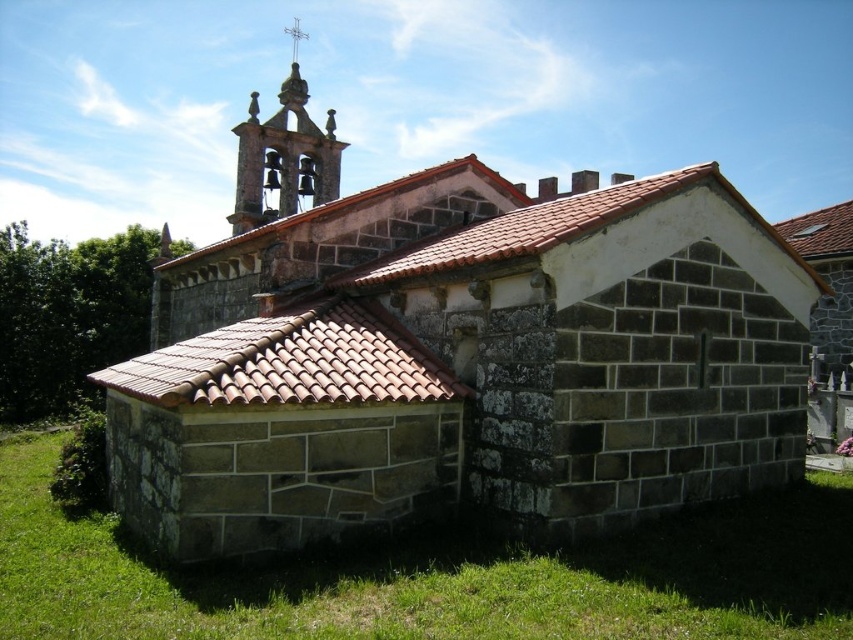
Who is shorter, green grass at lower center or brown tile roof at upper center?

green grass at lower center

Who is higher up, green grass at lower center or brown tile roof at upper center?

brown tile roof at upper center

Is point (51, 474) positioned behind point (424, 260)?

Yes, point (51, 474) is farther from viewer.

Where is `green grass at lower center`? The height and width of the screenshot is (640, 853). green grass at lower center is located at coordinates (437, 577).

How distant is brown tile roof at lower left from brown tile roof at upper center?

brown tile roof at lower left is 20.73 feet away from brown tile roof at upper center.

Is brown tile roof at lower left to the right of brown tile roof at upper center from the viewer's perspective?

Incorrect, brown tile roof at lower left is not on the right side of brown tile roof at upper center.

Is point (300, 372) behind point (485, 248)?

That is False.

Locate an element on the screen. The width and height of the screenshot is (853, 640). brown tile roof at lower left is located at coordinates (292, 362).

Measure the distance between green grass at lower center and brown tile roof at lower left.

7.37 meters

Who is taller, green grass at lower center or brown tile roof at lower left?

brown tile roof at lower left

Between point (107, 515) and point (404, 392), which one is positioned behind?

Positioned behind is point (107, 515).

The width and height of the screenshot is (853, 640). Identify the location of green grass at lower center. (437, 577).